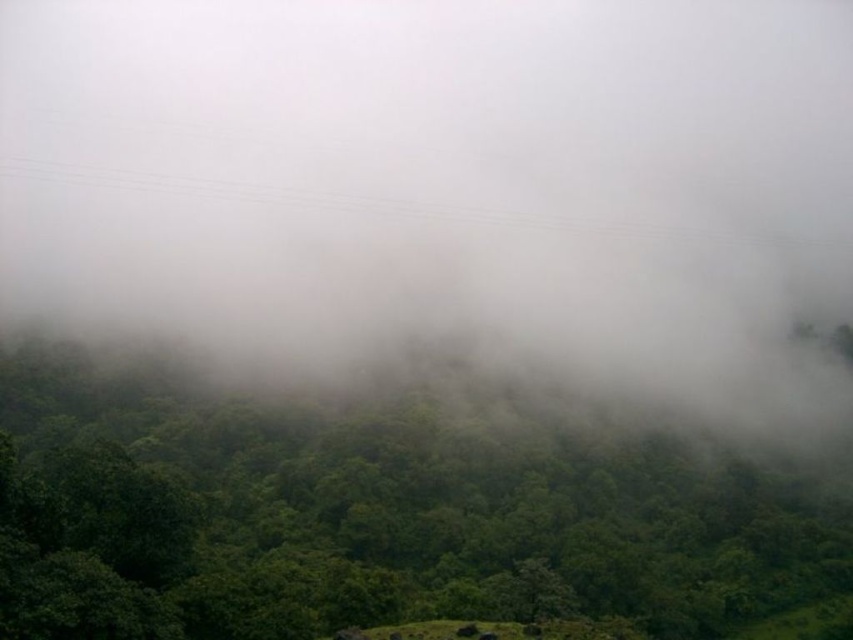
Between point (265, 177) and point (416, 497), which one is positioned in front?

Positioned in front is point (416, 497).

Between white misty fog at center and green leafy tree at center, which one has less height?

With less height is green leafy tree at center.

Locate an element on the screen. white misty fog at center is located at coordinates (447, 184).